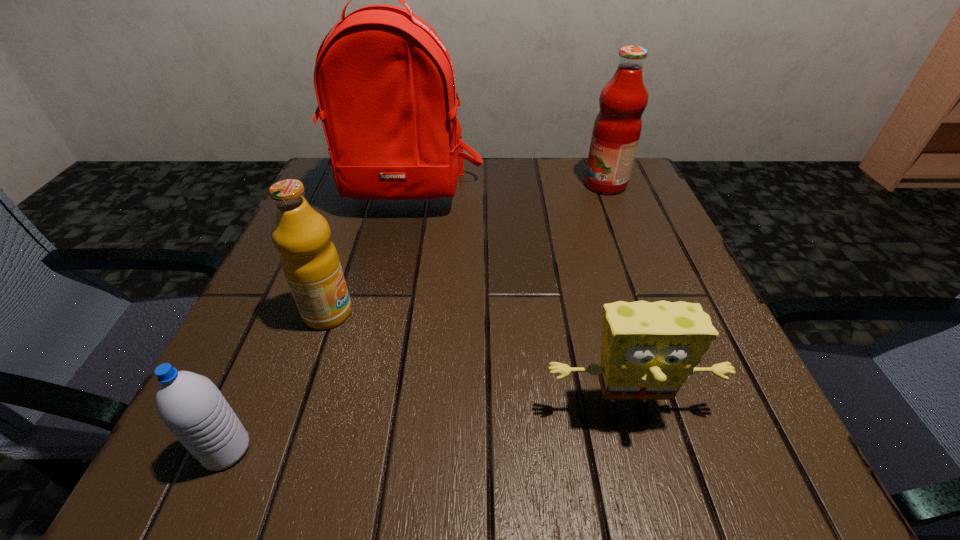
Select which object appears as the second closest to the sponge. Please provide its 2D coordinates. Your answer should be formatted as a tuple, i.e. [(x, y)], where the tuple contains the x and y coordinates of a point satisfying the conditions above.

[(190, 405)]

Where is `vacant position in the image that satisfies the following two spatial constraints: 1. on the front label of the right fruit juice; 2. on the main compartment of the backpack`? The height and width of the screenshot is (540, 960). vacant position in the image that satisfies the following two spatial constraints: 1. on the front label of the right fruit juice; 2. on the main compartment of the backpack is located at coordinates (609, 194).